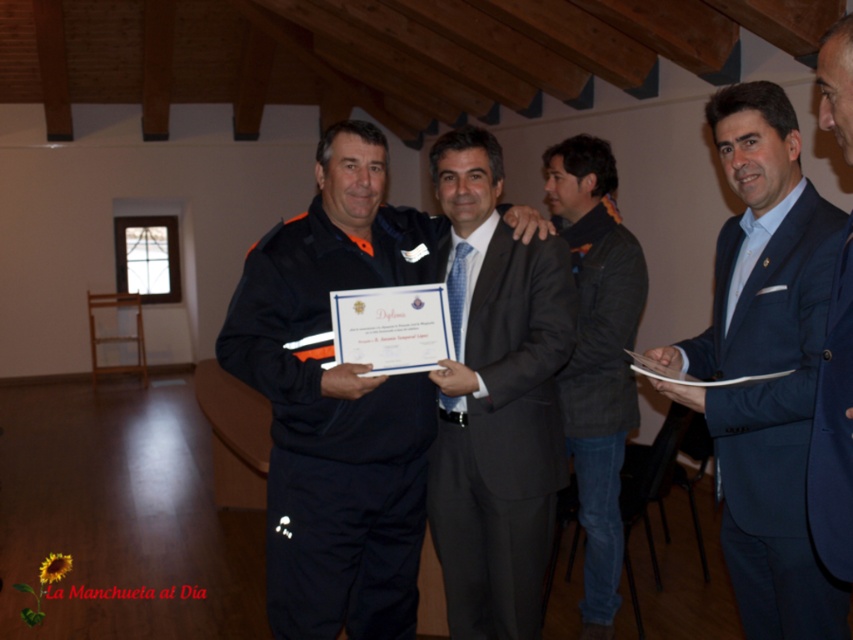
Between dark gray suit at center and blue fabric suit at center, which one is positioned lower?

dark gray suit at center is below.

How much distance is there between dark gray suit at center and blue fabric suit at center?

The distance of dark gray suit at center from blue fabric suit at center is 38.30 inches.

Describe the element at coordinates (503, 438) in the screenshot. I see `dark gray suit at center` at that location.

Identify the location of dark gray suit at center. The image size is (853, 640). click(x=503, y=438).

Who is higher up, dark gray textured jacket at center or blue fabric suit at center?

blue fabric suit at center

At what (x,y) coordinates should I click in order to perform the action: click on dark gray textured jacket at center. Please return your answer as a coordinate pair (x, y). Looking at the image, I should click on (596, 356).

Find the location of a particular element. This screenshot has height=640, width=853. dark gray textured jacket at center is located at coordinates (596, 356).

Image resolution: width=853 pixels, height=640 pixels. What do you see at coordinates (337, 403) in the screenshot? I see `matte black uniform at center` at bounding box center [337, 403].

Which is more to the left, matte black uniform at center or dark gray textured jacket at center?

matte black uniform at center is more to the left.

Does point (282, 605) lie in front of point (611, 346)?

Yes, point (282, 605) is closer to viewer.

Find the location of a particular element. The height and width of the screenshot is (640, 853). matte black uniform at center is located at coordinates (337, 403).